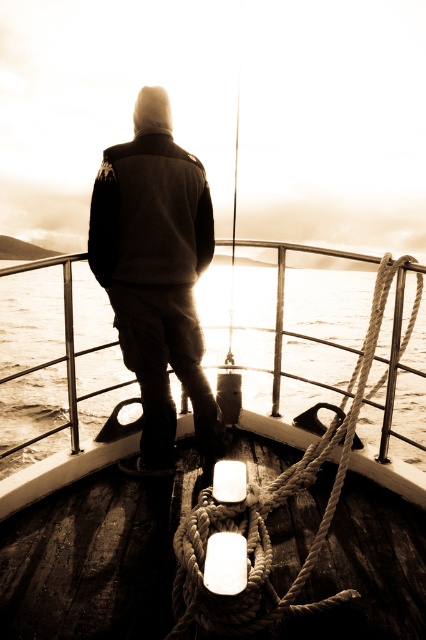
Question: Can you confirm if dark gray hoodie at center is wider than rope at center?

Choices:
 (A) no
 (B) yes

Answer: (A)

Question: Is dark gray hoodie at center bigger than rope at center?

Choices:
 (A) yes
 (B) no

Answer: (B)

Question: Considering the real-world distances, which object is farthest from the translucent water at center?

Choices:
 (A) rope at center
 (B) dark gray hoodie at center

Answer: (B)

Question: Which point appears farthest from the camera in this image?

Choices:
 (A) (98, 324)
 (B) (299, 588)
 (C) (112, 240)

Answer: (A)

Question: Which object appears farthest from the camera in this image?

Choices:
 (A) rope at center
 (B) translucent water at center
 (C) dark gray hoodie at center

Answer: (B)

Question: Observing the image, what is the correct spatial positioning of translucent water at center in reference to rope at center?

Choices:
 (A) right
 (B) left

Answer: (B)